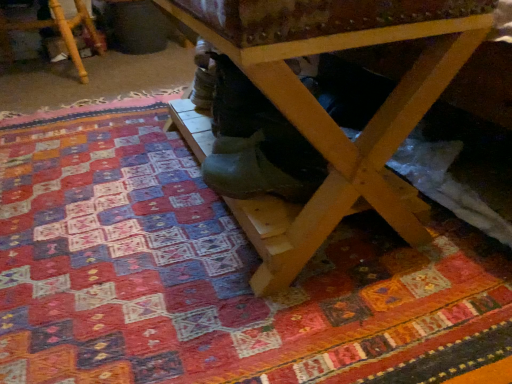
Question: From their relative heights in the image, would you say green rubber boot at center is taller or shorter than wooden stool at lower left?

Choices:
 (A) tall
 (B) short

Answer: (B)

Question: Is green rubber boot at center wider or thinner than wooden stool at lower left?

Choices:
 (A) wide
 (B) thin

Answer: (B)

Question: Which object is the closest to the wooden table at center?

Choices:
 (A) green rubber boot at center
 (B) wooden stool at lower left

Answer: (A)

Question: Estimate the real-world distances between objects in this image. Which object is farther from the wooden stool at lower left?

Choices:
 (A) wooden table at center
 (B) green rubber boot at center

Answer: (A)